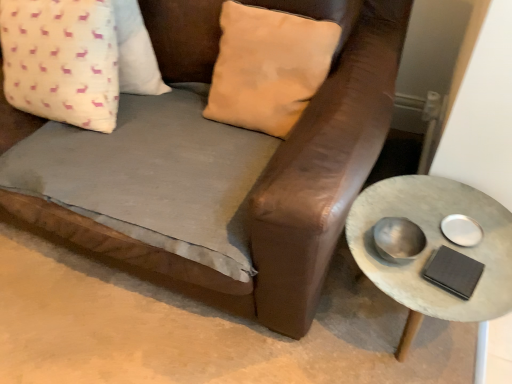
Question: Can you confirm if beige suede pillow at upper center, which is the first pillow in right-to-left order, is positioned to the left of rustic concrete side table at right?

Choices:
 (A) yes
 (B) no

Answer: (A)

Question: Is rustic concrete side table at right inside beige suede pillow at upper center, which is the 2th pillow from left to right?

Choices:
 (A) no
 (B) yes

Answer: (A)

Question: From a real-world perspective, is beige suede pillow at upper center, which is the 2th pillow from left to right, under rustic concrete side table at right?

Choices:
 (A) yes
 (B) no

Answer: (B)

Question: Is beige suede pillow at upper center, which is the first pillow in right-to-left order, further to camera compared to rustic concrete side table at right?

Choices:
 (A) yes
 (B) no

Answer: (A)

Question: Can we say beige suede pillow at upper center, which is the 2th pillow from left to right, lies outside rustic concrete side table at right?

Choices:
 (A) yes
 (B) no

Answer: (A)

Question: Visually, is beige suede pillow at upper center, which is the 2th pillow from left to right, positioned to the left or to the right of white fabric pillow with pink deer pattern at upper left, the 2th pillow positioned from the right?

Choices:
 (A) right
 (B) left

Answer: (A)

Question: Choose the correct answer: Is beige suede pillow at upper center, which is the first pillow in right-to-left order, inside white fabric pillow with pink deer pattern at upper left, the 2th pillow positioned from the right, or outside it?

Choices:
 (A) outside
 (B) inside

Answer: (A)

Question: In terms of height, does beige suede pillow at upper center, which is the 2th pillow from left to right, look taller or shorter compared to white fabric pillow with pink deer pattern at upper left, the 2th pillow positioned from the right?

Choices:
 (A) tall
 (B) short

Answer: (B)

Question: From the image's perspective, is beige suede pillow at upper center, which is the 2th pillow from left to right, located above or below white fabric pillow with pink deer pattern at upper left, placed as the 1th pillow when sorted from left to right?

Choices:
 (A) below
 (B) above

Answer: (A)

Question: From a real-world perspective, relative to brown leather couch at center, is beige suede pillow at upper center, which is the first pillow in right-to-left order, vertically above or below?

Choices:
 (A) above
 (B) below

Answer: (A)

Question: Would you say beige suede pillow at upper center, which is the 2th pillow from left to right, is inside or outside brown leather couch at center?

Choices:
 (A) outside
 (B) inside

Answer: (A)

Question: Relative to brown leather couch at center, is beige suede pillow at upper center, which is the first pillow in right-to-left order, in front or behind?

Choices:
 (A) front
 (B) behind

Answer: (B)

Question: Would you say beige suede pillow at upper center, which is the first pillow in right-to-left order, is to the left or to the right of brown leather couch at center in the picture?

Choices:
 (A) right
 (B) left

Answer: (A)

Question: Considering their positions, is brown leather couch at center located in front of or behind beige suede pillow at upper center, which is the 2th pillow from left to right?

Choices:
 (A) front
 (B) behind

Answer: (A)

Question: In the image, is brown leather couch at center on the left side or the right side of beige suede pillow at upper center, which is the 2th pillow from left to right?

Choices:
 (A) right
 (B) left

Answer: (B)